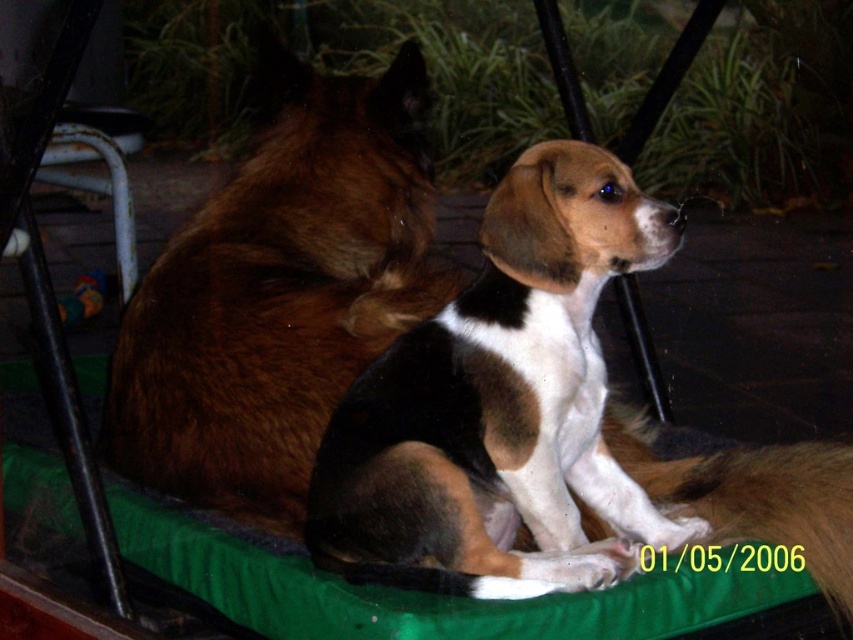
You are standing in front of the two dogs resting on the green cushioned surface. There are two points marked in the image. Point A is at coordinates point (561, 163) and Point B is at coordinates point (252, 348). If you were to throw a treat towards Point A and Point B, which point would the treat land closer to the front of the scene?

Point A at coordinates point (561, 163) is in front of point (252, 348), so the treat thrown towards Point A would land closer to the front of the scene.